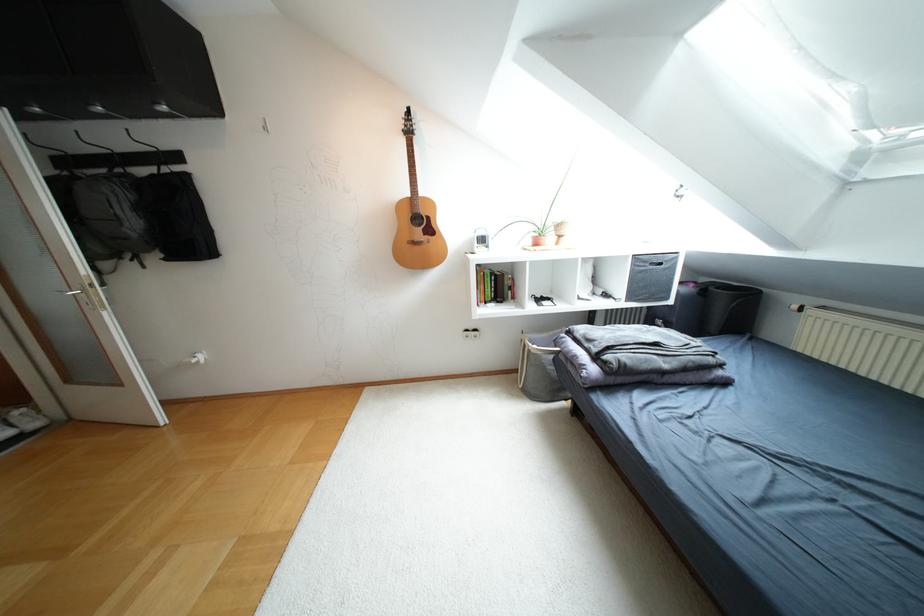
The width and height of the screenshot is (924, 616). What do you see at coordinates (678, 192) in the screenshot?
I see `a skylight window handle` at bounding box center [678, 192].